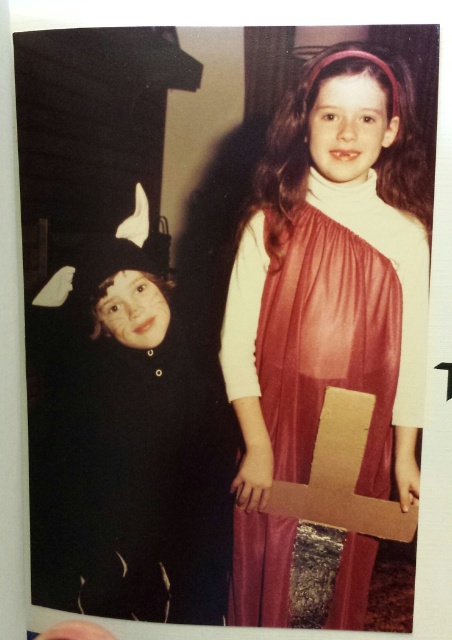
Does shiny red dress at center have a smaller size compared to black felt costume at left?

Actually, shiny red dress at center might be larger than black felt costume at left.

Which is in front, point (405, 337) or point (174, 388)?

Point (405, 337)

Locate an element on the screen. This screenshot has width=452, height=640. shiny red dress at center is located at coordinates (326, 324).